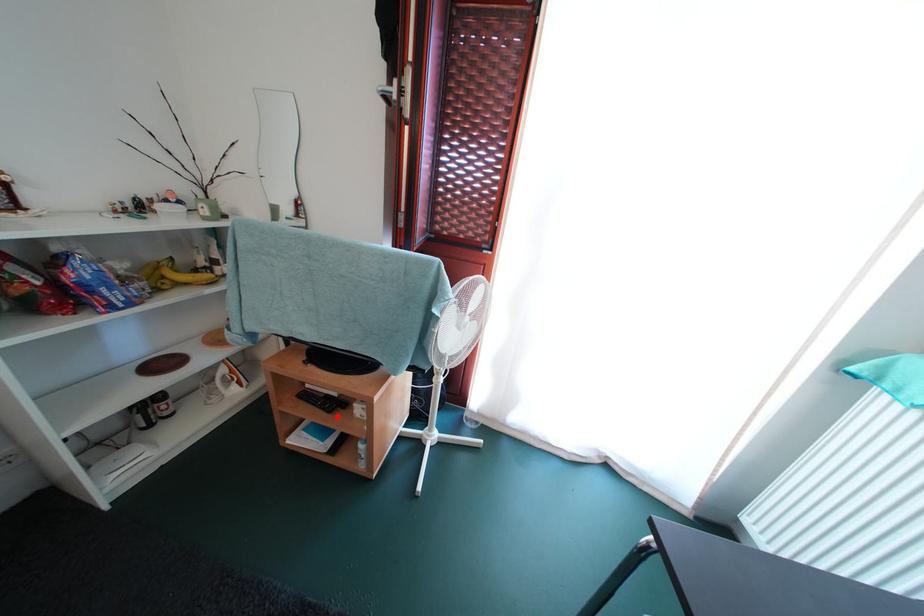
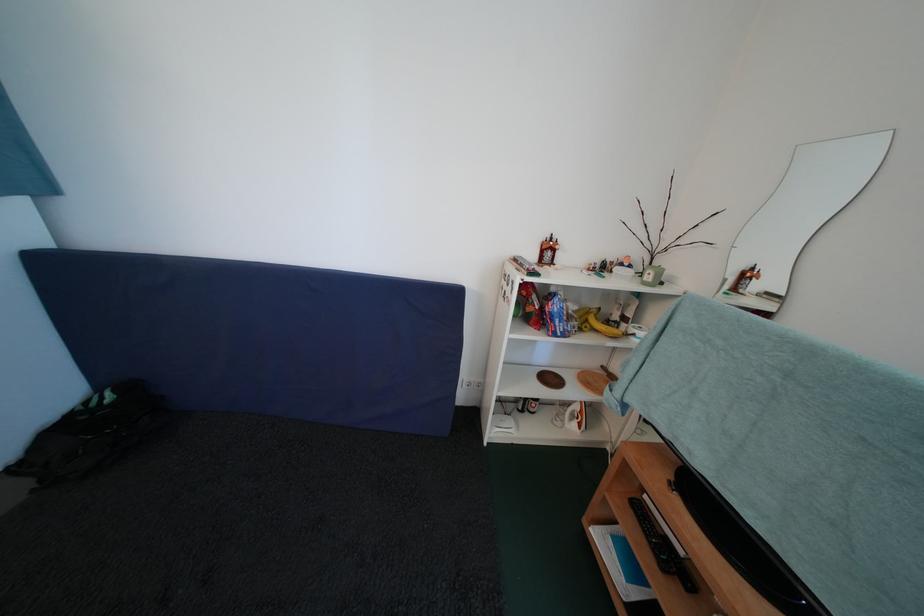
Question: I am providing you with two images of the same scene from different viewpoints. Image1 has a red point marked. In image2, the corresponding 3D location appears at what relative position? Reply with the corresponding letter.

Choices:
 (A) Closer
 (B) Farther

Answer: (A)